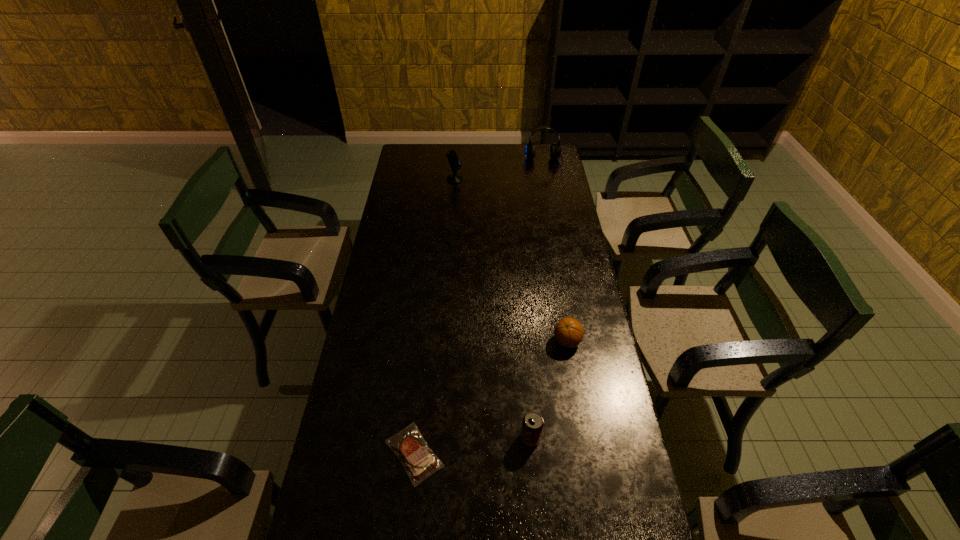
Where is `object that is at the far edge`? This screenshot has height=540, width=960. object that is at the far edge is located at coordinates (555, 150).

The image size is (960, 540). What are the coordinates of `object present at the left edge` in the screenshot? It's located at (419, 461).

The height and width of the screenshot is (540, 960). I want to click on headset positioned at the right edge, so click(x=555, y=150).

The height and width of the screenshot is (540, 960). What are the coordinates of `orange that is at the right edge` in the screenshot? It's located at (568, 332).

Locate an element on the screen. Image resolution: width=960 pixels, height=540 pixels. object situated at the far right corner is located at coordinates (555, 150).

In the image, there is a desktop. Identify the location of vacant space at the left edge. Image resolution: width=960 pixels, height=540 pixels. (352, 356).

The height and width of the screenshot is (540, 960). In the image, there is a desktop. In order to click on vacant region at the right edge in this screenshot , I will do [560, 240].

I want to click on free space at the far left corner of the desktop, so click(x=418, y=148).

The width and height of the screenshot is (960, 540). Find the location of `unoccupied position between the third object from left to right and the farthest object`. unoccupied position between the third object from left to right and the farthest object is located at coordinates (538, 301).

This screenshot has width=960, height=540. In order to click on empty location between the farthest object and the soda can in this screenshot , I will do `click(538, 301)`.